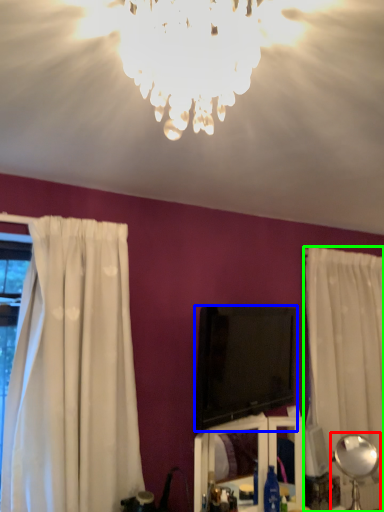
Question: Considering the real-world distances, which object is closest to lamp (highlighted by a red box)? television (highlighted by a blue box) or curtain (highlighted by a green box).

Choices:
 (A) television
 (B) curtain

Answer: (B)